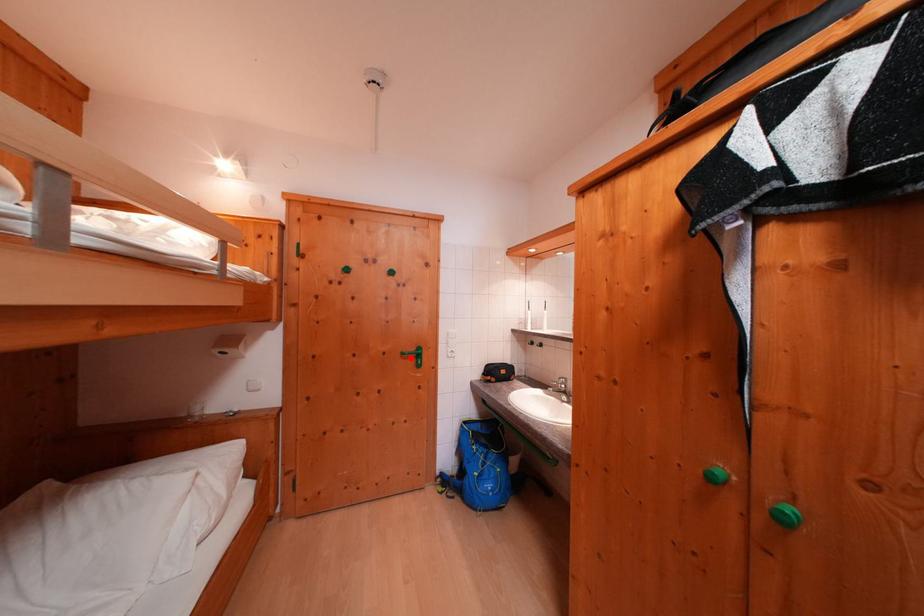
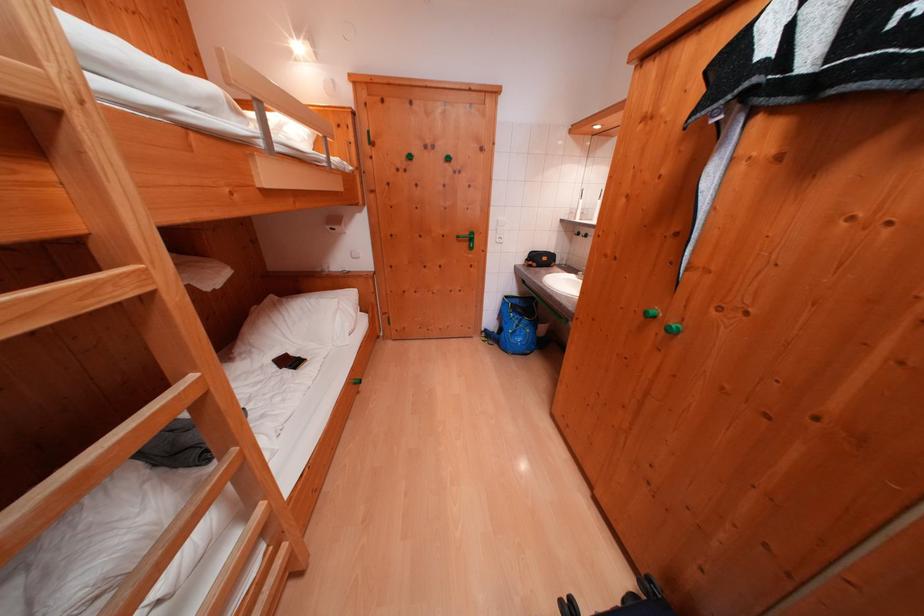
Where in the second image is the point corresponding to the highlighted location from the first image?

(466, 241)